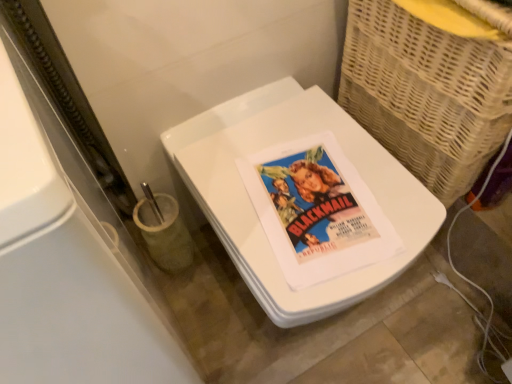
At what (x,y) coordinates should I click in order to perform the action: click on free space in front of matte paper poster at center. Please return your answer as a coordinate pair (x, y). The height and width of the screenshot is (384, 512). Looking at the image, I should click on (313, 271).